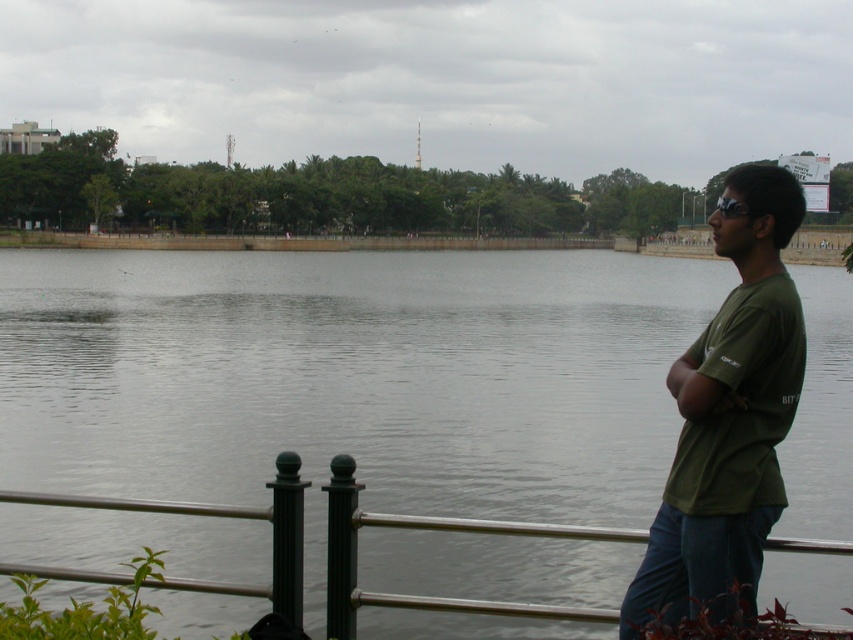
You are standing at the lakeside and want to walk towards the gray water at center. There is a metallic silver rail at lower center in your path. Which direction should you move relative to the rail to reach the water?

The gray water at center is positioned on the left side of the metallic silver rail at lower center. To reach the water, you should move to the left side of the rail.

From the picture: You are a photographer trying to capture the man in the scene. You want to focus on the green matte shirt at right and the black matte goggles at upper right. Which object should you adjust your camera focus on first if you want to ensure both are in focus?

The green matte shirt at right is closer to the viewer than the black matte goggles at upper right, so you should focus on the green matte shirt at right first to ensure both are in focus.

You are a photographer planning to capture the entire lakeside scene in one shot. Given that your camera can only focus on objects within a 100 cm width, and the metallic silver rail at lower center is 30 cm wide, will the gray water at center fit entirely within the frame?

The gray water at center has a larger size compared to metallic silver rail at lower center, which is 30 cm wide. Since the camera can focus on objects within a 100 cm width, the gray water at center may not fit entirely within the frame if its width exceeds 100 cm. However, the exact dimensions of the gray water at center are not provided, so it is uncertain whether it will fit completely.